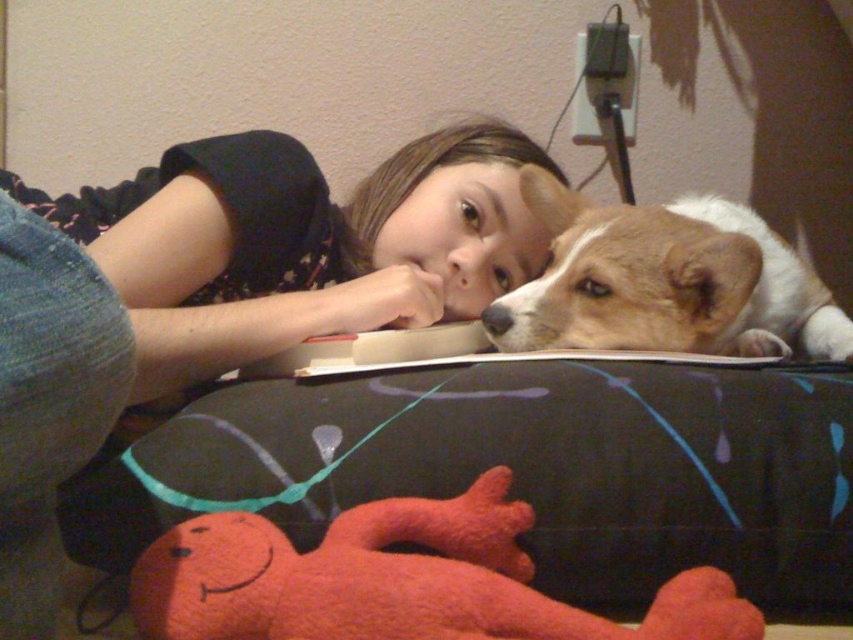
Question: Does matte black shirt at upper center have a smaller size compared to fluffy red plush at lower center?

Choices:
 (A) no
 (B) yes

Answer: (A)

Question: Is fluffy red plush at lower center to the right of brown and white fur at upper right from the viewer's perspective?

Choices:
 (A) yes
 (B) no

Answer: (B)

Question: Is black fabric pillow at lower center to the left of fluffy red plush at lower center from the viewer's perspective?

Choices:
 (A) no
 (B) yes

Answer: (A)

Question: Which object is the farthest from the matte black shirt at upper center?

Choices:
 (A) black fabric pillow at lower center
 (B) fluffy red plush at lower center

Answer: (B)

Question: Which of these objects is positioned closest to the black fabric pillow at lower center?

Choices:
 (A) brown and white fur at upper right
 (B) fluffy red plush at lower center
 (C) matte black shirt at upper center

Answer: (B)

Question: Which object is closer to the camera taking this photo?

Choices:
 (A) matte black shirt at upper center
 (B) fluffy red plush at lower center
 (C) brown and white fur at upper right

Answer: (A)